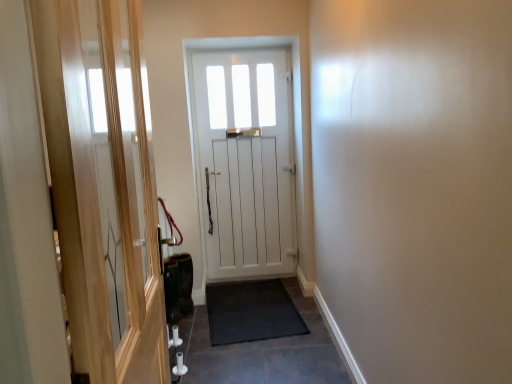
Locate an element on the screen. This screenshot has height=384, width=512. blank space situated above black rubber mat at center (from a real-world perspective) is located at coordinates (252, 327).